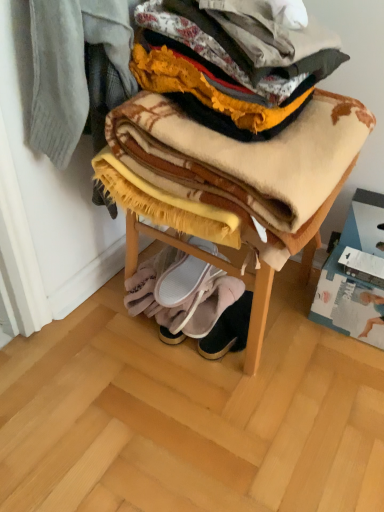
This screenshot has width=384, height=512. What are the coordinates of `free space above leather suede booties at lower center, the third footwear viewed from the top (from a real-world perspective)` in the screenshot? It's located at (231, 315).